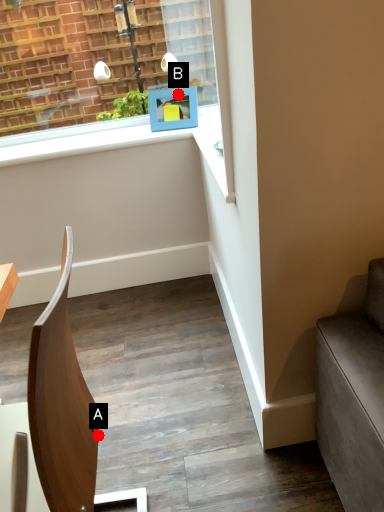
Question: Two points are circled on the image, labeled by A and B beside each circle. Which of the following is the closest to the observer?

Choices:
 (A) A is closer
 (B) B is closer

Answer: (A)